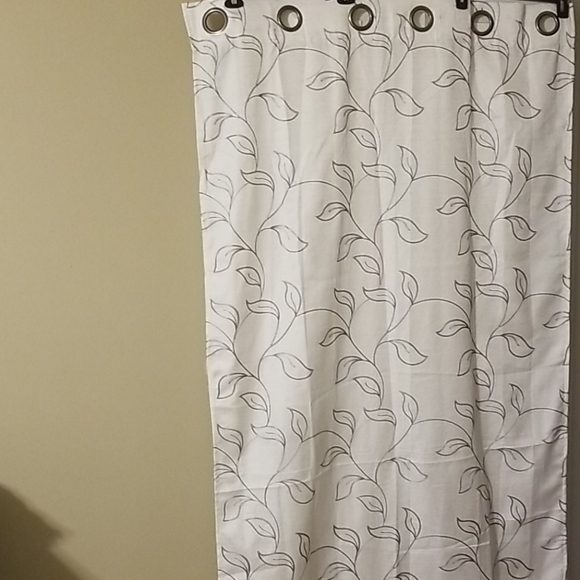
The height and width of the screenshot is (580, 580). In order to click on brown wall in this screenshot , I will do click(59, 187).